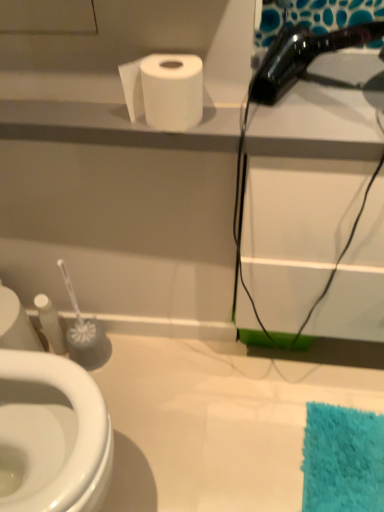
Describe the element at coordinates (303, 56) in the screenshot. This screenshot has width=384, height=512. I see `shiny black hair dryer at upper right` at that location.

Measure the distance between shiny black hair dryer at upper right and camera.

shiny black hair dryer at upper right and camera are 31.45 inches apart.

Find the location of `shiny black hair dryer at upper right`. shiny black hair dryer at upper right is located at coordinates (303, 56).

What do you see at coordinates (165, 90) in the screenshot?
I see `white matte toilet paper at upper center` at bounding box center [165, 90].

Image resolution: width=384 pixels, height=512 pixels. Identify the location of white matte toilet paper at upper center. (165, 90).

Locate an element on the screen. shiny black hair dryer at upper right is located at coordinates (303, 56).

Which object is positioned more to the left, white matte toilet paper at upper center or shiny black hair dryer at upper right?

white matte toilet paper at upper center.

Which is behind, white matte toilet paper at upper center or shiny black hair dryer at upper right?

white matte toilet paper at upper center is further from the camera.

Considering the positions of point (185, 98) and point (380, 28), is point (185, 98) closer or farther from the camera than point (380, 28)?

Point (185, 98) is closer to the camera than point (380, 28).

From the image's perspective, between white matte toilet paper at upper center and shiny black hair dryer at upper right, which one is located above?

shiny black hair dryer at upper right.

From a real-world perspective, which object stands above the other?

shiny black hair dryer at upper right.

Between white matte toilet paper at upper center and shiny black hair dryer at upper right, which one has smaller width?

white matte toilet paper at upper center.

Does white matte toilet paper at upper center have a lesser height compared to shiny black hair dryer at upper right?

Yes.

Does white matte toilet paper at upper center have a smaller size compared to shiny black hair dryer at upper right?

Indeed, white matte toilet paper at upper center has a smaller size compared to shiny black hair dryer at upper right.

Is white matte toilet paper at upper center inside or outside of shiny black hair dryer at upper right?

white matte toilet paper at upper center is outside shiny black hair dryer at upper right.

Would you consider white matte toilet paper at upper center to be distant from shiny black hair dryer at upper right?

white matte toilet paper at upper center is actually quite close to shiny black hair dryer at upper right.

Is white matte toilet paper at upper center turned away from shiny black hair dryer at upper right?

No, white matte toilet paper at upper center's orientation is not away from shiny black hair dryer at upper right.

How many degrees apart are the facing directions of white matte toilet paper at upper center and shiny black hair dryer at upper right?

There is a 0.000627-degree angle between the facing directions of white matte toilet paper at upper center and shiny black hair dryer at upper right.

Locate an element on the screen. toilet paper that appears behind the shiny black hair dryer at upper right is located at coordinates (165, 90).

Is shiny black hair dryer at upper right to the left of white matte toilet paper at upper center from the viewer's perspective?

No, shiny black hair dryer at upper right is not to the left of white matte toilet paper at upper center.

Is the position of shiny black hair dryer at upper right more distant than that of white matte toilet paper at upper center?

No, it is in front of white matte toilet paper at upper center.

Does point (279, 48) come farther from viewer compared to point (156, 124)?

Yes, it is behind point (156, 124).

From the image's perspective, is shiny black hair dryer at upper right positioned above or below white matte toilet paper at upper center?

shiny black hair dryer at upper right is situated higher than white matte toilet paper at upper center in the image.

From a real-world perspective, who is located higher, shiny black hair dryer at upper right or white matte toilet paper at upper center?

In real-world perspective, shiny black hair dryer at upper right is above.

Can you confirm if shiny black hair dryer at upper right is wider than white matte toilet paper at upper center?

Yes.

From their relative heights in the image, would you say shiny black hair dryer at upper right is taller or shorter than white matte toilet paper at upper center?

→ shiny black hair dryer at upper right is taller than white matte toilet paper at upper center.

Does shiny black hair dryer at upper right have a larger size compared to white matte toilet paper at upper center?

Yes, shiny black hair dryer at upper right is bigger than white matte toilet paper at upper center.

Which is correct: shiny black hair dryer at upper right is inside white matte toilet paper at upper center, or outside of it?

shiny black hair dryer at upper right lies outside white matte toilet paper at upper center.

Are shiny black hair dryer at upper right and white matte toilet paper at upper center far apart?

No, shiny black hair dryer at upper right is not far from white matte toilet paper at upper center.

Is shiny black hair dryer at upper right facing away from white matte toilet paper at upper center?

No, shiny black hair dryer at upper right is not facing away from white matte toilet paper at upper center.

The image size is (384, 512). I want to click on hair drier that appears above the white matte toilet paper at upper center (from a real-world perspective), so click(303, 56).

Identify the location of hair drier in front of the white matte toilet paper at upper center. (303, 56).

Locate an element on the screen. The image size is (384, 512). hair drier that appears above the white matte toilet paper at upper center (from a real-world perspective) is located at coordinates pyautogui.click(x=303, y=56).